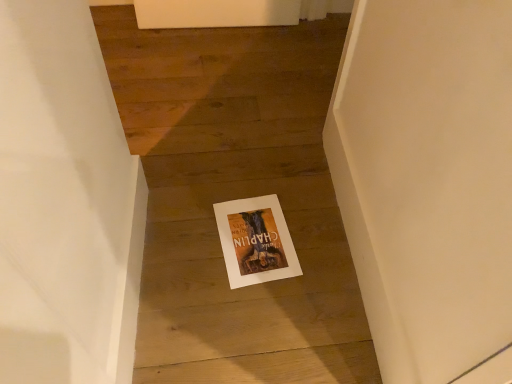
This screenshot has width=512, height=384. In order to click on vacant space that is to the left of white paper at center in this screenshot , I will do `click(179, 232)`.